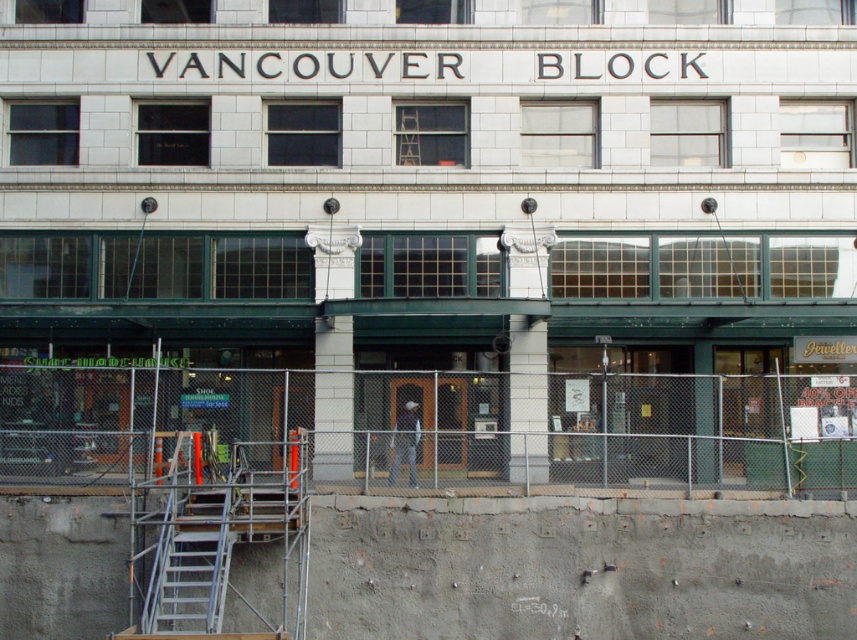
Question: Does chain-link fence at center appear on the right side of dark gray fabric construction worker at center?

Choices:
 (A) no
 (B) yes

Answer: (B)

Question: Can you confirm if metal scaffolding at lower left is smaller than dark gray fabric construction worker at center?

Choices:
 (A) yes
 (B) no

Answer: (B)

Question: Among these points, which one is nearest to the camera?

Choices:
 (A) (426, 499)
 (B) (397, 445)
 (C) (6, 436)
 (D) (202, 612)

Answer: (D)

Question: Which object is closer to the camera taking this photo?

Choices:
 (A) chain-link fence at center
 (B) dark gray fabric construction worker at center

Answer: (A)

Question: Can you confirm if chain-link fence at center is smaller than dark gray fabric construction worker at center?

Choices:
 (A) yes
 (B) no

Answer: (B)

Question: Which object is the closest to the metal scaffolding at lower left?

Choices:
 (A) chain-link fence at center
 (B) dark gray fabric construction worker at center
 (C) metallic gray staircase at lower left

Answer: (A)